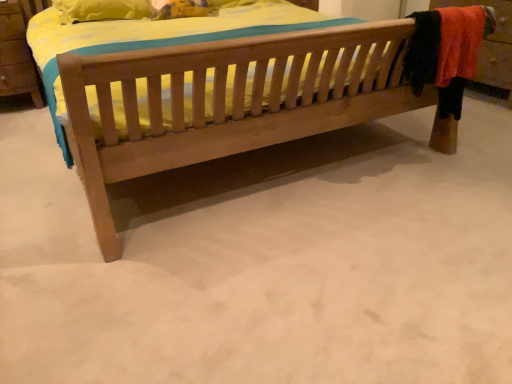
Question: From the image's perspective, is wooden dresser at right on top of natural wood bed at center?

Choices:
 (A) yes
 (B) no

Answer: (A)

Question: Is wooden dresser at right placed right next to natural wood bed at center?

Choices:
 (A) yes
 (B) no

Answer: (B)

Question: Considering the relative positions of wooden dresser at right and natural wood bed at center in the image provided, is wooden dresser at right behind natural wood bed at center?

Choices:
 (A) yes
 (B) no

Answer: (A)

Question: Considering the relative sizes of wooden dresser at right and natural wood bed at center in the image provided, is wooden dresser at right shorter than natural wood bed at center?

Choices:
 (A) yes
 (B) no

Answer: (B)

Question: Is natural wood bed at center located within wooden dresser at right?

Choices:
 (A) no
 (B) yes

Answer: (A)

Question: Is wooden dresser at right positioned in front of natural wood bed at center?

Choices:
 (A) yes
 (B) no

Answer: (B)

Question: Is natural wood bed at center behind wooden dresser at right?

Choices:
 (A) no
 (B) yes

Answer: (A)

Question: Is natural wood bed at center turned away from wooden dresser at right?

Choices:
 (A) yes
 (B) no

Answer: (B)

Question: From a real-world perspective, is natural wood bed at center on wooden dresser at right?

Choices:
 (A) no
 (B) yes

Answer: (A)

Question: From the image's perspective, is natural wood bed at center located above wooden dresser at right?

Choices:
 (A) no
 (B) yes

Answer: (A)

Question: From a real-world perspective, is natural wood bed at center under wooden dresser at right?

Choices:
 (A) no
 (B) yes

Answer: (B)

Question: Is natural wood bed at center taller than wooden dresser at right?

Choices:
 (A) yes
 (B) no

Answer: (B)

Question: Is natural wood bed at center taller or shorter than wooden dresser at right?

Choices:
 (A) tall
 (B) short

Answer: (B)